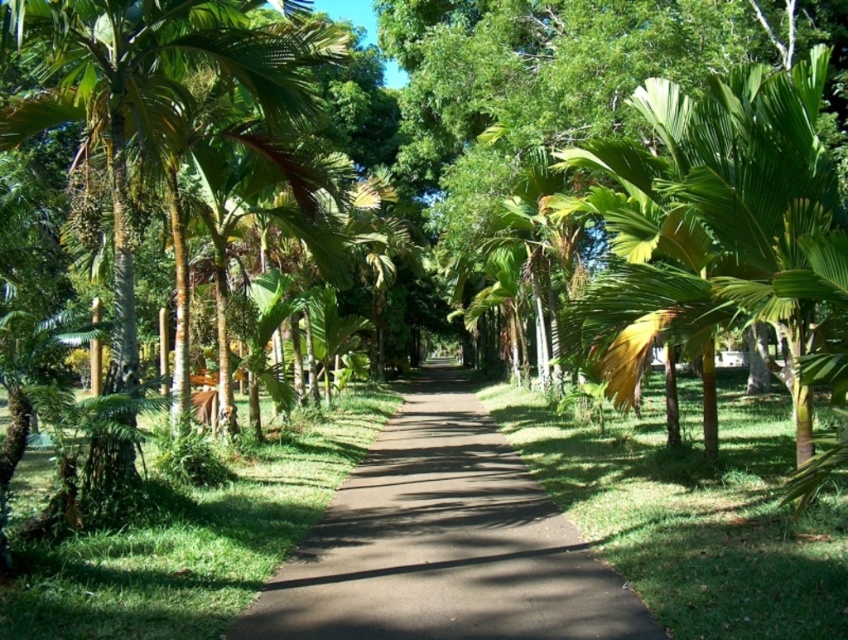
You are a gardener who needs to determine which area to water next. You see the brown asphalt pavement at center and the green grass at center. Which one is shorter?

The brown asphalt pavement at center is shorter than the green grass at center, so you should water the green grass at center first since it is taller and may need more water.

In the scene shown: You are a hiker standing at the start of the pathway and see the green leafy palm at center and the green leafy palm tree at left. Which palm tree appears taller from your perspective?

The green leafy palm tree at left appears taller than the green leafy palm at center because it has a greater height.